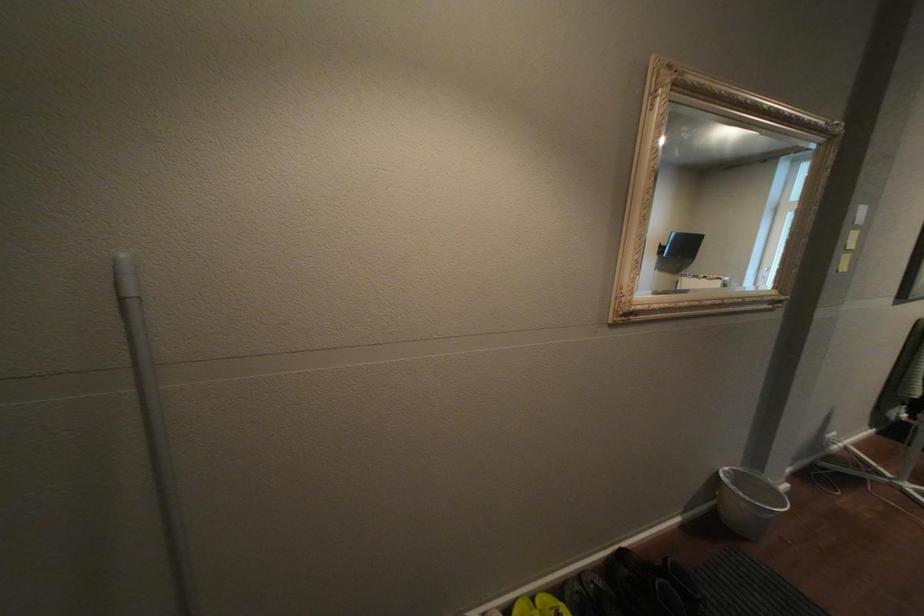
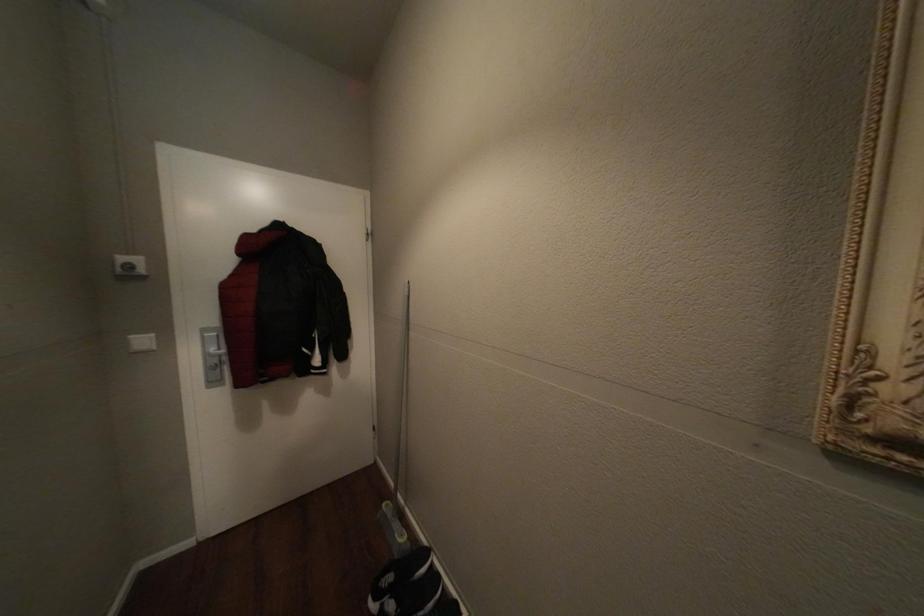
Question: The images are taken continuously from a first-person perspective. In which direction is your viewpoint rotating?

Choices:
 (A) Left
 (B) Right
 (C) Up
 (D) Down

Answer: (A)